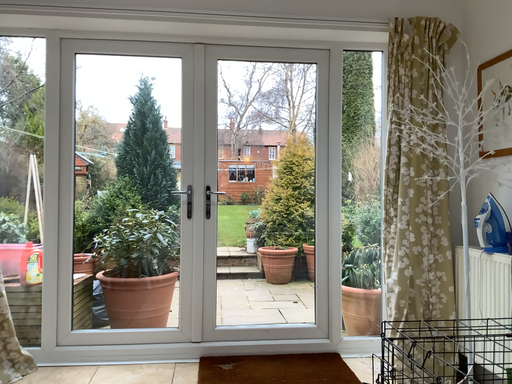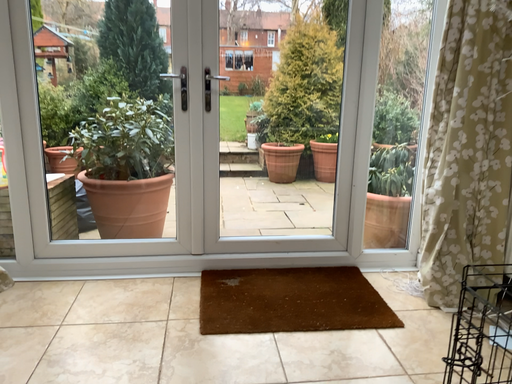
Question: How did the camera likely rotate when shooting the video?

Choices:
 (A) rotated upward
 (B) rotated downward

Answer: (B)